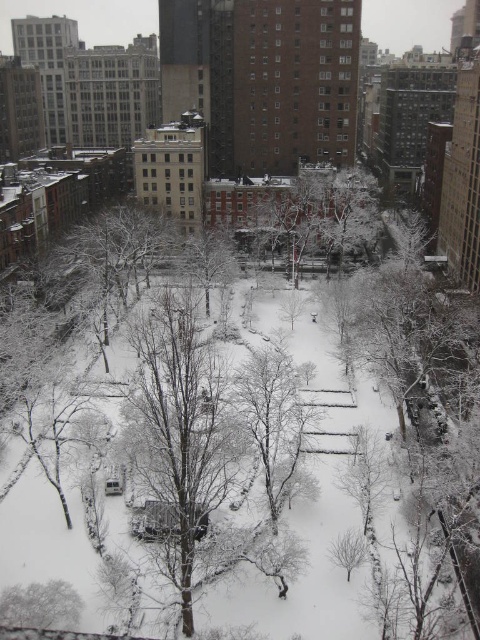
Question: Can you confirm if bare wood tree at center is bigger than brown textured tree at center?

Choices:
 (A) yes
 (B) no

Answer: (A)

Question: Does bare wood tree at center appear over snow-covered tree at center?

Choices:
 (A) no
 (B) yes

Answer: (B)

Question: Estimate the real-world distances between objects in this image. Which object is closer to the brown textured tree at center?

Choices:
 (A) snow-covered tree at lower left
 (B) bare wood tree at center
 (C) snow-covered tree at center

Answer: (B)

Question: Can you confirm if bare wood tree at center is wider than snow-covered tree at center?

Choices:
 (A) yes
 (B) no

Answer: (A)

Question: Which point is closer to the camera taking this photo?

Choices:
 (A) coord(200,250)
 (B) coord(289,440)

Answer: (B)

Question: Among these objects, which one is farthest from the camera?

Choices:
 (A) brown textured tree at center
 (B) snow-covered tree at center
 (C) snow-covered tree at lower left
 (D) bare wood tree at center

Answer: (A)